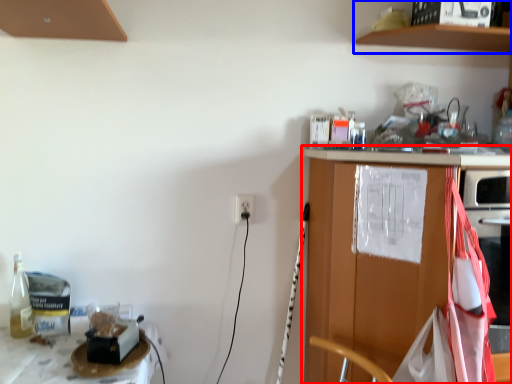
Question: Which point is further to the camera, countertop (highlighted by a red box) or shelf (highlighted by a blue box)?

Choices:
 (A) countertop
 (B) shelf

Answer: (B)